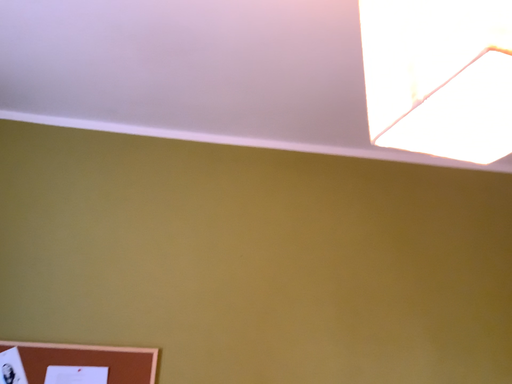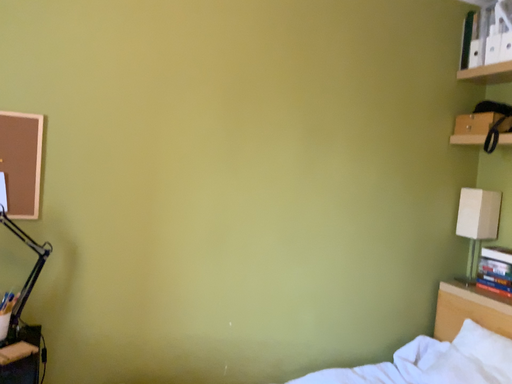
Question: Which way did the camera rotate in the video?

Choices:
 (A) rotated left
 (B) rotated right

Answer: (B)